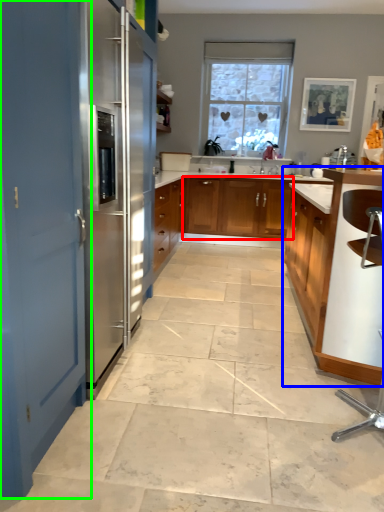
Question: Which is nearer to the cabinetry (highlighted by a red box)? cabinetry (highlighted by a blue box) or door (highlighted by a green box).

Choices:
 (A) cabinetry
 (B) door

Answer: (A)